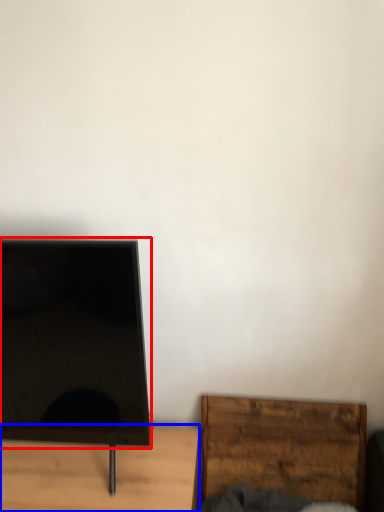
Question: Which object appears closest to the camera in this image, screen (highlighted by a red box) or furniture (highlighted by a blue box)?

Choices:
 (A) screen
 (B) furniture

Answer: (A)